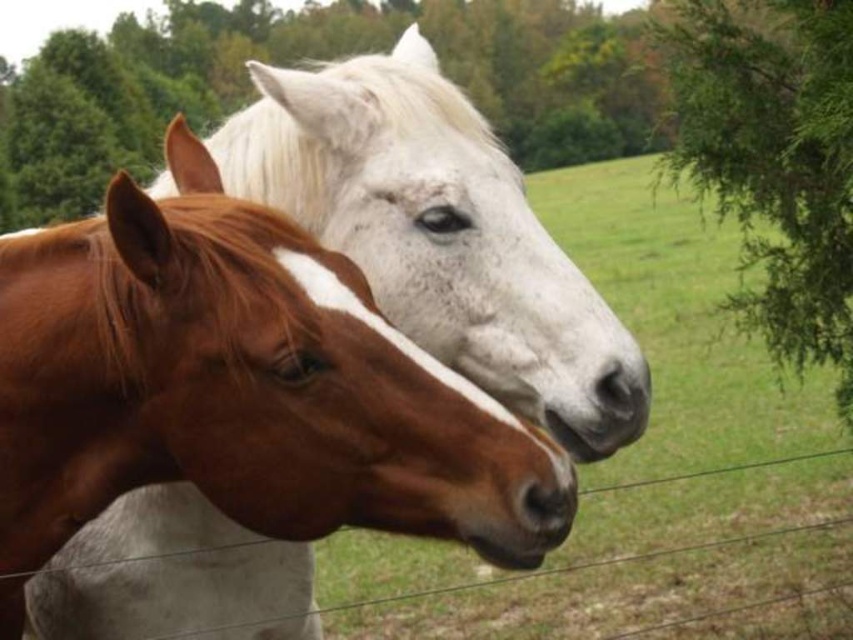
Is the position of green leafy tree at upper right more distant than that of wire mesh at lower center?

No, it is not.

Which is behind, point (724, 99) or point (827, 522)?

Positioned behind is point (827, 522).

Does point (767, 241) come in front of point (606, 563)?

Yes, it is.

Find the location of a particular element. This screenshot has height=640, width=853. green leafy tree at upper right is located at coordinates (773, 157).

Is brown glossy horse at center below wire mesh at lower center?

Incorrect, brown glossy horse at center is not positioned below wire mesh at lower center.

Is point (163, 232) positioned after point (486, 582)?

No, (163, 232) is closer to viewer.

Where is `brown glossy horse at center`? brown glossy horse at center is located at coordinates pos(241,388).

Does brown glossy horse at center appear over green leafy tree at upper right?

No, brown glossy horse at center is not above green leafy tree at upper right.

Is point (479, 396) more distant than point (753, 1)?

No, (479, 396) is in front of (753, 1).

At what (x,y) coordinates should I click in order to perform the action: click on brown glossy horse at center. Please return your answer as a coordinate pair (x, y). Looking at the image, I should click on (241, 388).